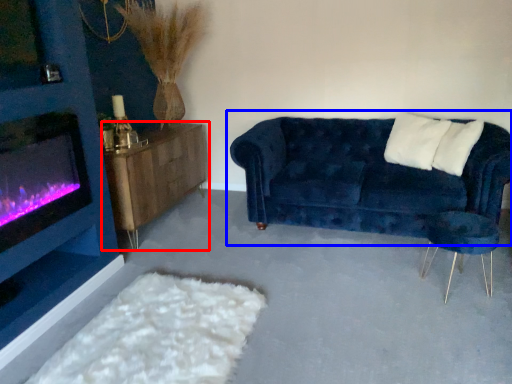
Question: Which point is further to the camera, table (highlighted by a red box) or studio couch (highlighted by a blue box)?

Choices:
 (A) table
 (B) studio couch

Answer: (A)